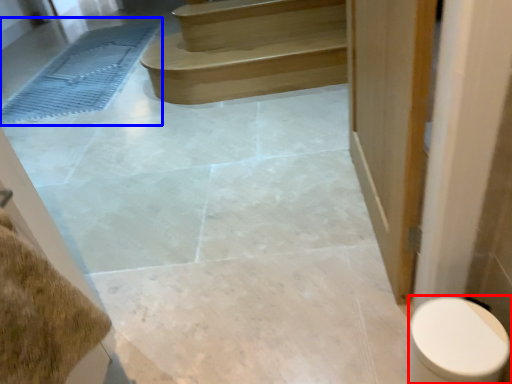
Question: Which of the following is the closest to the observer, toilet (highlighted by a red box) or bath mat (highlighted by a blue box)?

Choices:
 (A) toilet
 (B) bath mat

Answer: (A)